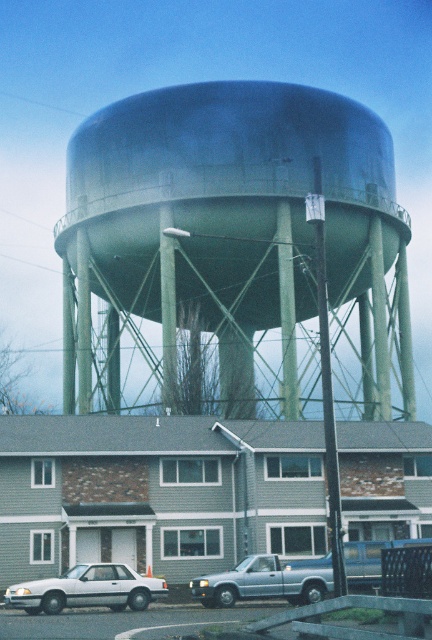
Is green matte water tower at center bigger than metallic silver truck at center?

Indeed, green matte water tower at center has a larger size compared to metallic silver truck at center.

Who is higher up, green matte water tower at center or metallic silver truck at center?

green matte water tower at center is higher up.

The width and height of the screenshot is (432, 640). I want to click on green matte water tower at center, so click(x=231, y=241).

Identify the location of green matte water tower at center. The height and width of the screenshot is (640, 432). (231, 241).

Is white matte sedan at lower left shorter than silver metallic truck at lower center?

Yes.

This screenshot has width=432, height=640. Describe the element at coordinates (86, 589) in the screenshot. I see `white matte sedan at lower left` at that location.

Between point (40, 609) and point (304, 584), which one is positioned in front?

Point (40, 609)

Identify the location of white matte sedan at lower left. The image size is (432, 640). (86, 589).

Is green matte water tower at center above silver metallic truck at lower center?

Yes.

Locate an element on the screen. This screenshot has width=432, height=640. green matte water tower at center is located at coordinates (231, 241).

Is point (240, 404) closer to camera compared to point (253, 579)?

No, it is behind (253, 579).

Where is `green matte water tower at center`? The width and height of the screenshot is (432, 640). green matte water tower at center is located at coordinates (231, 241).